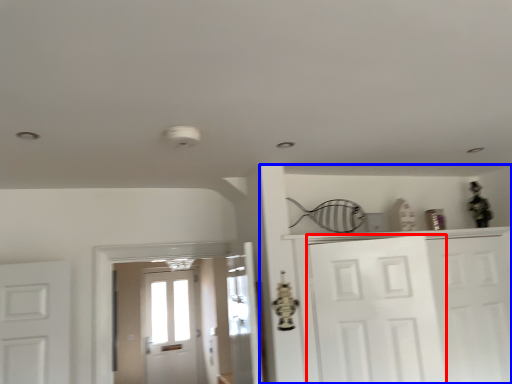
Question: Which point is closer to the camera, door (highlighted by a red box) or dresser (highlighted by a blue box)?

Choices:
 (A) door
 (B) dresser

Answer: (A)